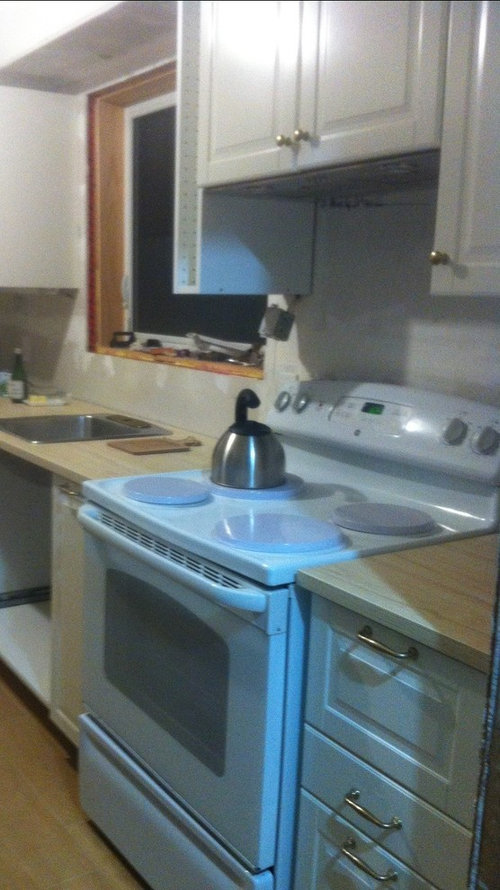
Image resolution: width=500 pixels, height=890 pixels. I want to click on lcd display, so click(x=372, y=407).